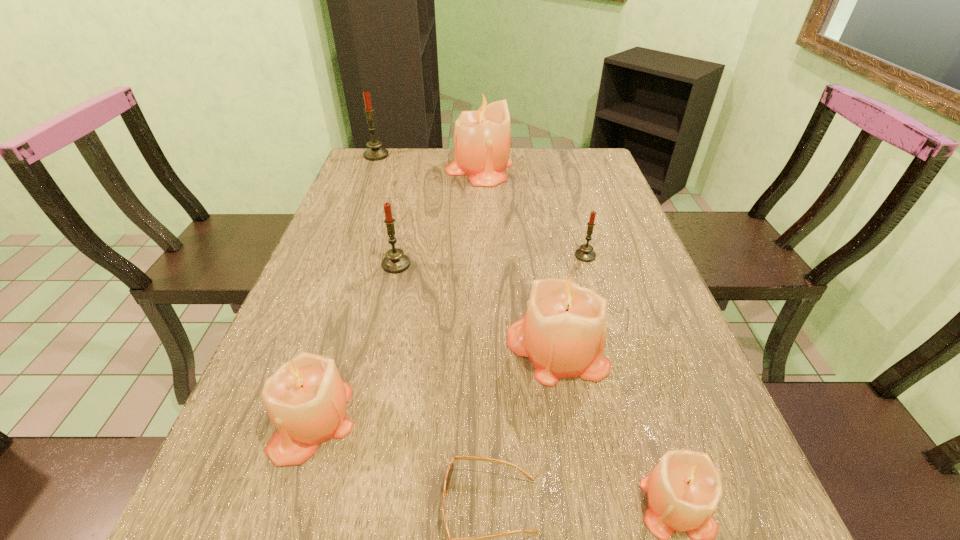
The image size is (960, 540). What are the coordinates of `vacant region located 0.180m on the back of the second smallest red candle` in the screenshot? It's located at (407, 217).

You are a GUI agent. You are given a task and a screenshot of the screen. Output one action in this format:
    pyautogui.click(x=<x>, y=<y>)
    Task: Click on the vacant space located on the back of the second smallest beige candle
    This screenshot has height=540, width=960.
    Given the screenshot: What is the action you would take?
    pyautogui.click(x=354, y=285)

Identify the location of vacant space located 0.250m on the back of the smallest red candle. This screenshot has height=540, width=960. (569, 199).

This screenshot has width=960, height=540. In order to click on object positioned at the right edge in this screenshot , I will do `click(585, 253)`.

In order to click on object situated at the far left corner in this screenshot , I will do `click(375, 152)`.

In the image, there is a desktop. Identify the location of vacant space at the far edge. This screenshot has height=540, width=960. (410, 175).

The image size is (960, 540). In the image, there is a desktop. What are the coordinates of `vacant space at the left edge` in the screenshot? It's located at (347, 197).

Image resolution: width=960 pixels, height=540 pixels. I want to click on free spot at the right edge of the desktop, so click(639, 310).

The height and width of the screenshot is (540, 960). I want to click on free point at the far left corner, so click(x=349, y=177).

Identify the location of empty location between the third smallest beige candle and the biggest beige candle. Image resolution: width=960 pixels, height=540 pixels. click(x=518, y=258).